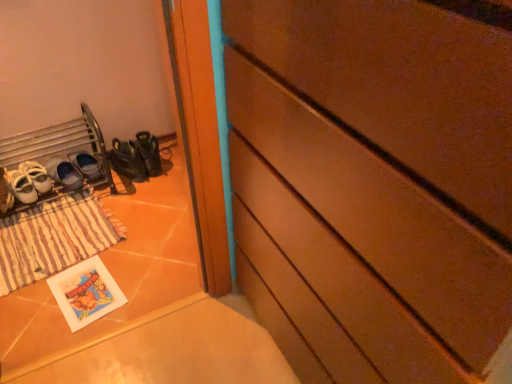
Question: From a real-world perspective, is white leather shoes at left, which is counted as the first footwear, starting from the left, positioned above or below green rubber boots at lower left?

Choices:
 (A) below
 (B) above

Answer: (B)

Question: Is white leather shoes at left, which is counted as the first footwear, starting from the left, inside the boundaries of green rubber boots at lower left, or outside?

Choices:
 (A) inside
 (B) outside

Answer: (B)

Question: Which is farther from the white leather shoes at left, placed as the 3th footwear when sorted from left to right?

Choices:
 (A) matte black shoes at lower left, the first footwear when ordered from right to left
 (B) matte paper postcard at lower left
 (C) brown striped mat at lower left
 (D) green rubber boots at lower left
 (E) white leather shoes at left, placed as the 3th footwear when sorted from right to left

Answer: (B)

Question: Which is farther from the matte paper postcard at lower left?

Choices:
 (A) white leather shoes at left, the fourth footwear from the right
 (B) white leather shoes at left, placed as the 3th footwear when sorted from right to left
 (C) matte black shoes at lower left, the first footwear when ordered from right to left
 (D) green rubber boots at lower left
 (E) brown matte chest of drawers at center

Answer: (E)